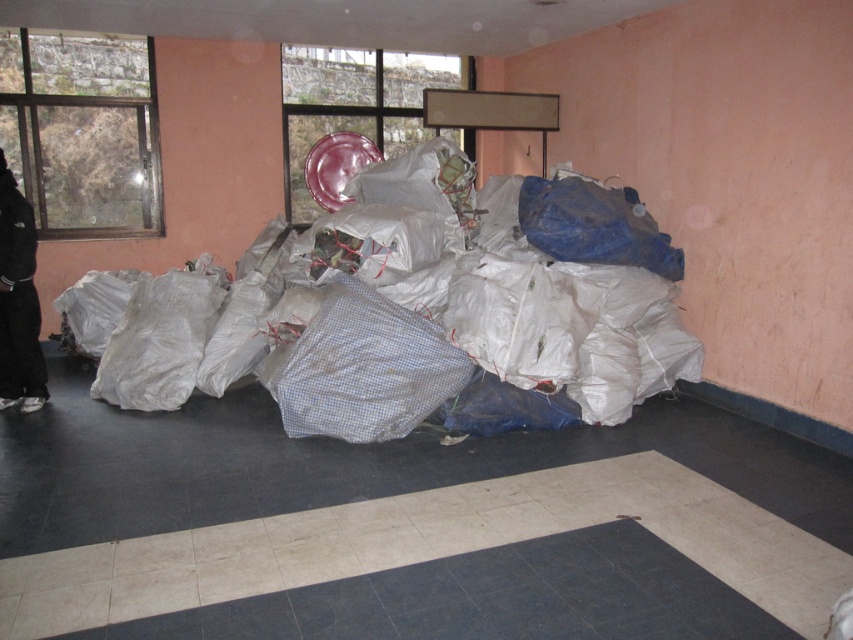
Is white plastic bags at center to the right of black fabric pants at left from the viewer's perspective?

Indeed, white plastic bags at center is positioned on the right side of black fabric pants at left.

Which is in front, point (561, 301) or point (28, 234)?

Point (561, 301)

Is point (683, 378) positioned before point (39, 403)?

No.

At what (x,y) coordinates should I click in order to perform the action: click on white plastic bags at center. Please return your answer as a coordinate pair (x, y). Looking at the image, I should click on (415, 316).